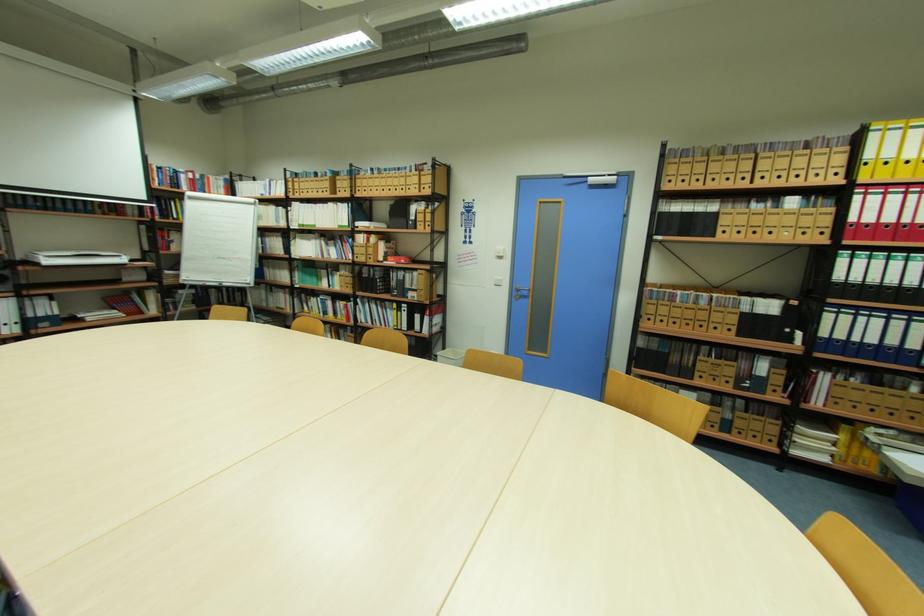
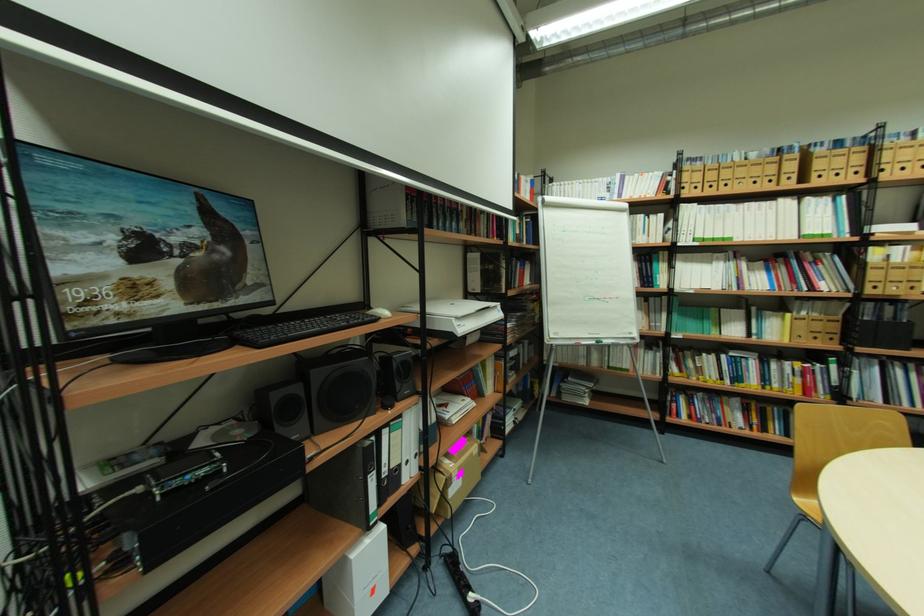
The images are taken continuously from a first-person perspective. In which direction are you moving?

The movement direction of the cameraman is left, forward.